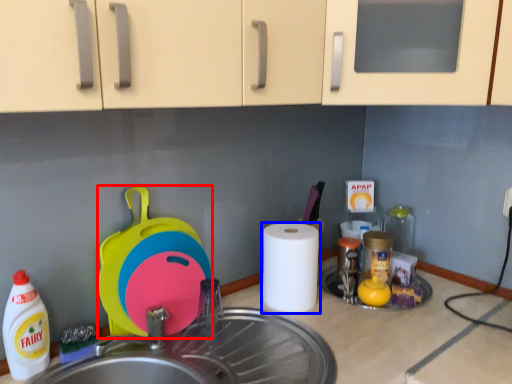
Question: Which object appears closest to the camera in this image, appliance (highlighted by a red box) or paper towel (highlighted by a blue box)?

Choices:
 (A) appliance
 (B) paper towel

Answer: (A)